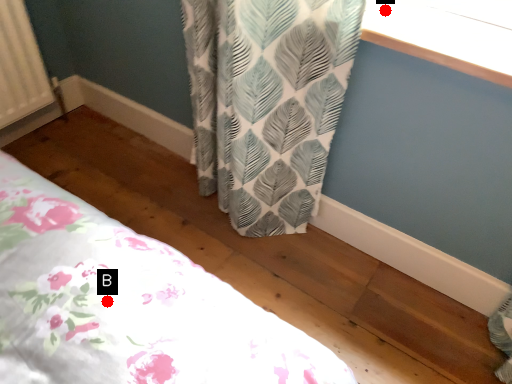
Question: Two points are circled on the image, labeled by A and B beside each circle. Which point is farther from the camera taking this photo?

Choices:
 (A) A is further
 (B) B is further

Answer: (A)